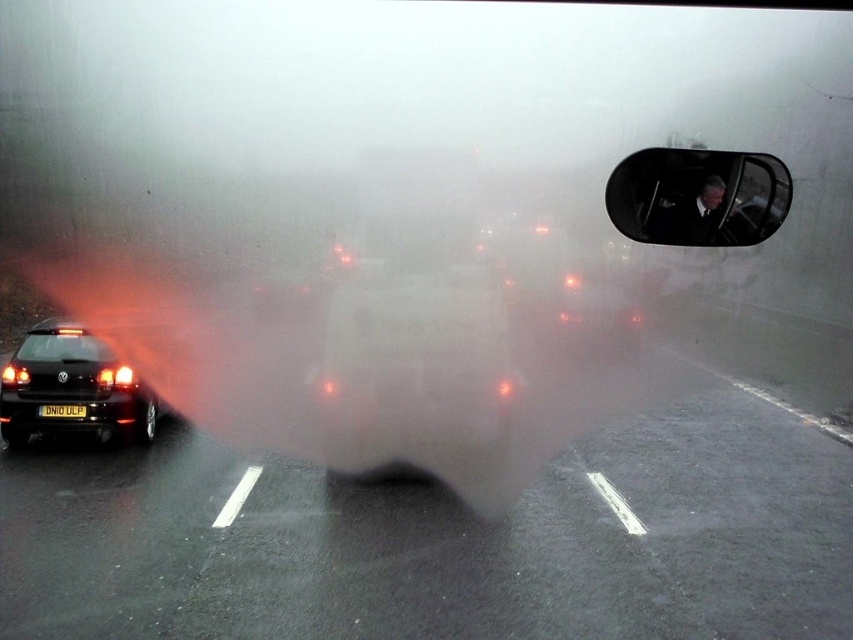
Which is more to the right, black plastic view mirror at upper right or black plastic license plate at lower left?

Positioned to the right is black plastic view mirror at upper right.

Is black plastic view mirror at upper right positioned at the back of black plastic license plate at lower left?

No, it is not.

Looking at this image, who is more forward, (773,196) or (73,413)?

Positioned in front is point (773,196).

The height and width of the screenshot is (640, 853). Find the location of `black plastic view mirror at upper right`. black plastic view mirror at upper right is located at coordinates (698, 196).

Can you confirm if black plastic view mirror at upper right is positioned above shiny black car at left?

Yes, black plastic view mirror at upper right is above shiny black car at left.

Does point (695, 189) lie in front of point (102, 376)?

That is True.

Image resolution: width=853 pixels, height=640 pixels. I want to click on black plastic view mirror at upper right, so click(x=698, y=196).

Is black rubber car at left shorter than black plastic license plate at lower left?

In fact, black rubber car at left may be taller than black plastic license plate at lower left.

The image size is (853, 640). What do you see at coordinates (444, 538) in the screenshot?
I see `black rubber car at left` at bounding box center [444, 538].

Between point (503, 540) and point (56, 413), which one is positioned behind?

The point (56, 413) is behind.

Locate an element on the screen. The image size is (853, 640). black rubber car at left is located at coordinates (444, 538).